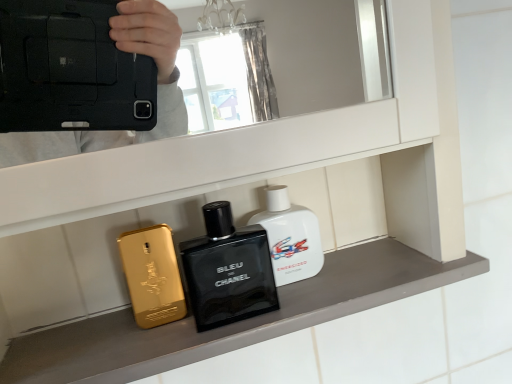
Locate an element on the screen. This screenshot has height=384, width=512. free space that is to the left of white glossy bottle at center, the 2th perfume in the left-to-right sequence is located at coordinates (151, 316).